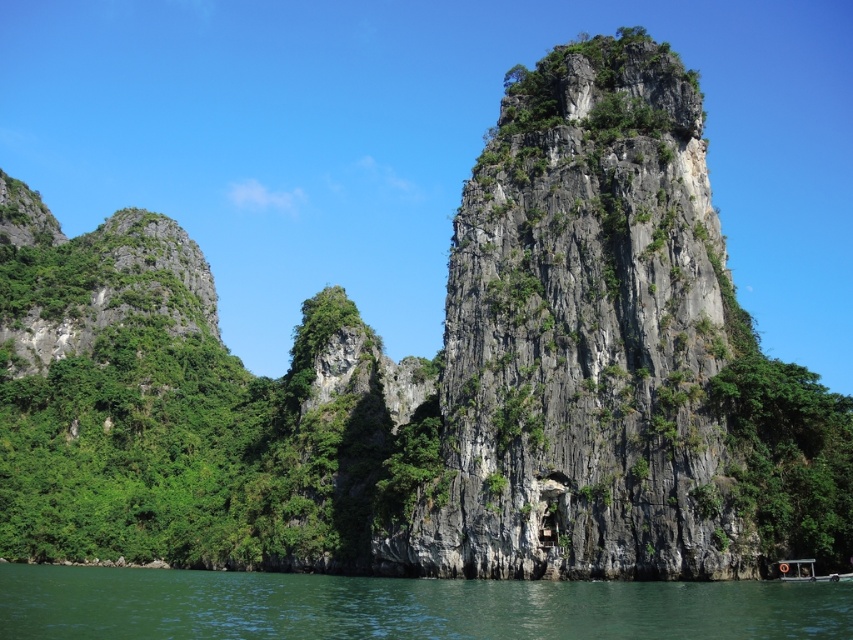
Question: Which object is farther from the camera taking this photo?

Choices:
 (A) green water at lower center
 (B) gray rocky cliff at center

Answer: (B)

Question: Does gray rocky cliff at center have a larger size compared to green water at lower center?

Choices:
 (A) yes
 (B) no

Answer: (B)

Question: Which object appears farthest from the camera in this image?

Choices:
 (A) green water at lower center
 (B) gray rocky cliff at center

Answer: (B)

Question: Is gray rocky cliff at center above green water at lower center?

Choices:
 (A) yes
 (B) no

Answer: (A)

Question: Does gray rocky cliff at center come in front of green water at lower center?

Choices:
 (A) no
 (B) yes

Answer: (A)